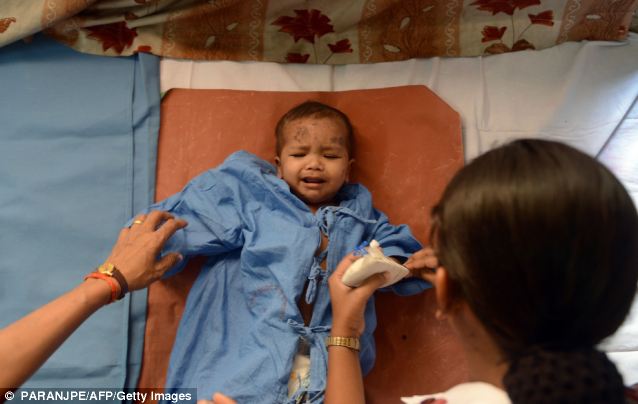
I want to click on white bed shets, so click(570, 90).